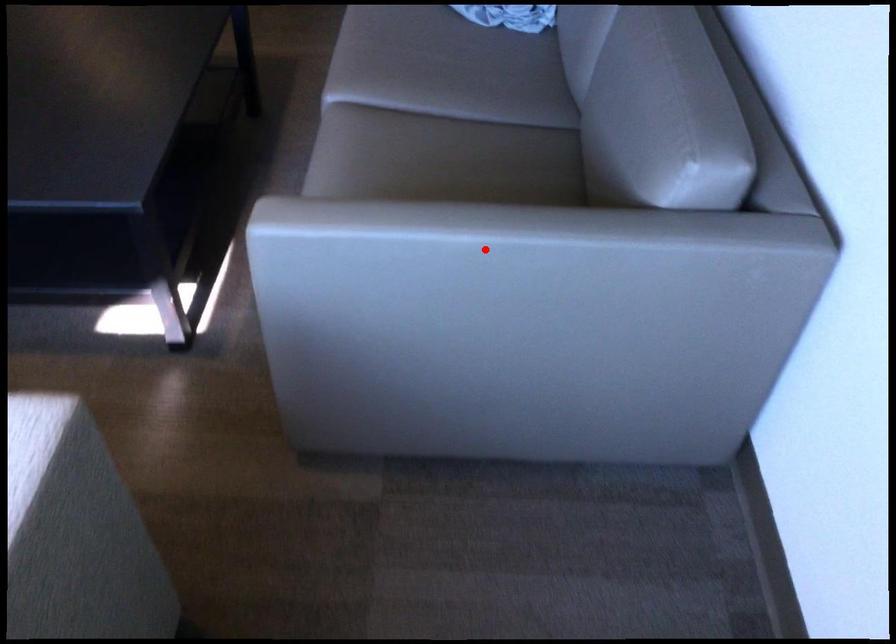
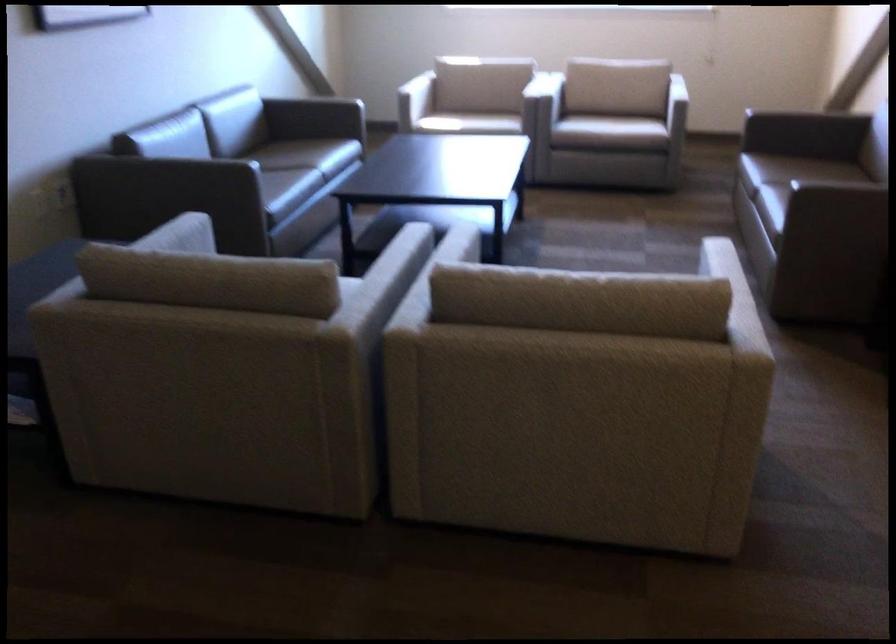
Question: I am providing you with two images of the same scene from different viewpoints. A red point is marked on the first image. Is the red point's position out of view in image 2?

Choices:
 (A) Yes
 (B) No

Answer: (A)